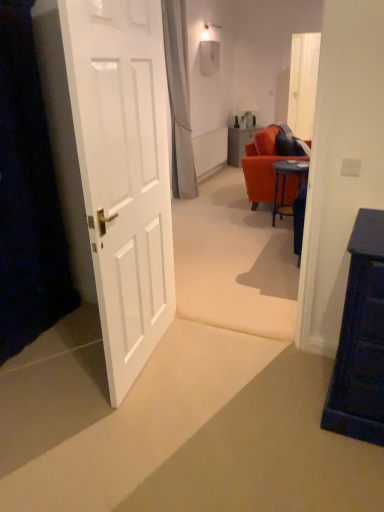
Question: Is there a large distance between blue glossy desk at center and matte orange table at center?

Choices:
 (A) yes
 (B) no

Answer: (A)

Question: Does blue glossy desk at center lie in front of matte orange table at center?

Choices:
 (A) no
 (B) yes

Answer: (B)

Question: Is blue glossy desk at center wider than matte orange table at center?

Choices:
 (A) no
 (B) yes

Answer: (A)

Question: Is blue glossy desk at center bigger than matte orange table at center?

Choices:
 (A) no
 (B) yes

Answer: (A)

Question: From the image's perspective, is blue glossy desk at center located above matte orange table at center?

Choices:
 (A) no
 (B) yes

Answer: (A)

Question: Is blue glossy desk at center positioned beyond the bounds of matte orange table at center?

Choices:
 (A) no
 (B) yes

Answer: (B)

Question: Is matte white lampshade at center further to camera compared to white glossy door at left?

Choices:
 (A) no
 (B) yes

Answer: (B)

Question: Can you confirm if matte white lampshade at center is positioned to the right of white glossy door at left?

Choices:
 (A) yes
 (B) no

Answer: (A)

Question: Does matte white lampshade at center have a lesser width compared to white glossy door at left?

Choices:
 (A) yes
 (B) no

Answer: (B)

Question: Could you tell me if matte white lampshade at center is facing white glossy door at left?

Choices:
 (A) yes
 (B) no

Answer: (B)

Question: Does matte white lampshade at center have a greater height compared to white glossy door at left?

Choices:
 (A) no
 (B) yes

Answer: (A)

Question: Is matte white lampshade at center shorter than white glossy door at left?

Choices:
 (A) no
 (B) yes

Answer: (B)

Question: Is white glossy door at left not near blue glossy desk at center?

Choices:
 (A) no
 (B) yes

Answer: (B)